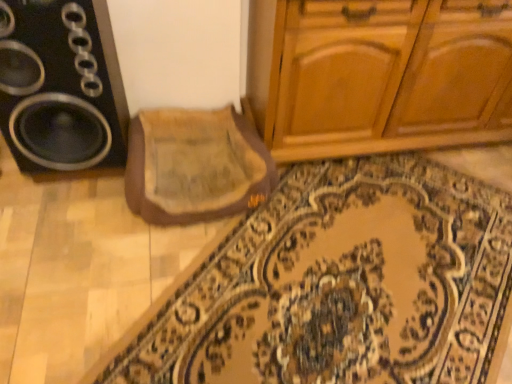
Question: Is there a large distance between beige fabric mat at center and black plastic speaker at left?

Choices:
 (A) yes
 (B) no

Answer: (B)

Question: Is beige fabric mat at center bigger than black plastic speaker at left?

Choices:
 (A) no
 (B) yes

Answer: (A)

Question: From the image's perspective, does beige fabric mat at center appear higher than black plastic speaker at left?

Choices:
 (A) no
 (B) yes

Answer: (A)

Question: From the image's perspective, would you say beige fabric mat at center is shown under black plastic speaker at left?

Choices:
 (A) no
 (B) yes

Answer: (B)

Question: Is beige fabric mat at center placed right next to black plastic speaker at left?

Choices:
 (A) yes
 (B) no

Answer: (B)

Question: Does beige fabric mat at center appear on the left side of black plastic speaker at left?

Choices:
 (A) yes
 (B) no

Answer: (B)

Question: Is beige fabric mat at center not within carpeted mat at center?

Choices:
 (A) yes
 (B) no

Answer: (A)

Question: Is carpeted mat at center surrounded by beige fabric mat at center?

Choices:
 (A) yes
 (B) no

Answer: (B)

Question: Is beige fabric mat at center oriented towards carpeted mat at center?

Choices:
 (A) no
 (B) yes

Answer: (A)

Question: Is beige fabric mat at center smaller than carpeted mat at center?

Choices:
 (A) no
 (B) yes

Answer: (B)

Question: Is beige fabric mat at center closer to the viewer compared to carpeted mat at center?

Choices:
 (A) yes
 (B) no

Answer: (B)

Question: Can you confirm if beige fabric mat at center is taller than carpeted mat at center?

Choices:
 (A) no
 (B) yes

Answer: (B)

Question: Does black plastic speaker at left lie in front of beige fabric mat at center?

Choices:
 (A) no
 (B) yes

Answer: (B)